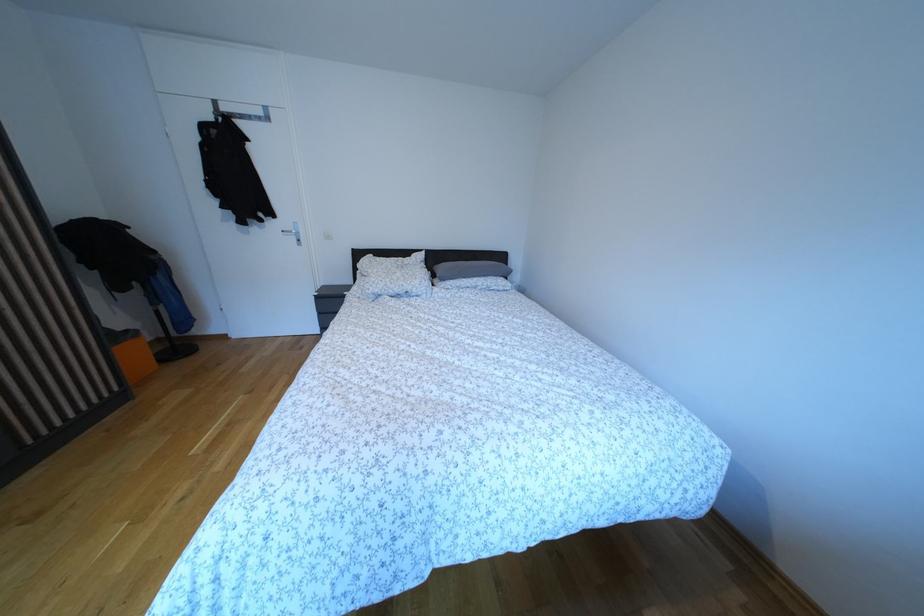
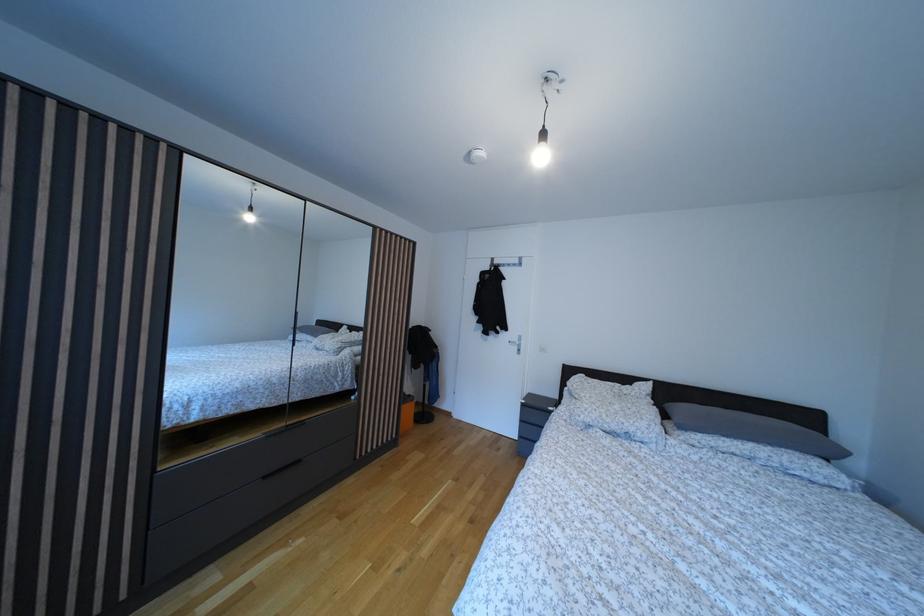
The images are taken continuously from a first-person perspective. In which direction is your viewpoint rotating?

The camera rotated toward left-up.